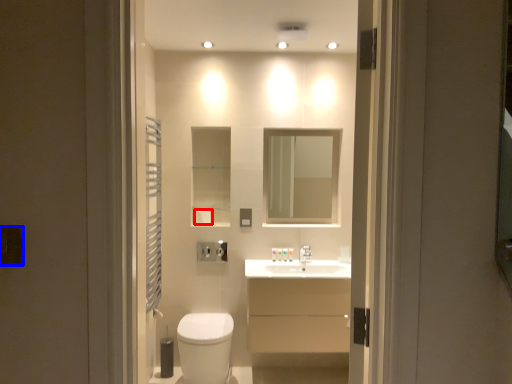
Question: Which object is closer to the camera taking this photo, toilet paper (highlighted by a red box) or electric outlet (highlighted by a blue box)?

Choices:
 (A) toilet paper
 (B) electric outlet

Answer: (B)